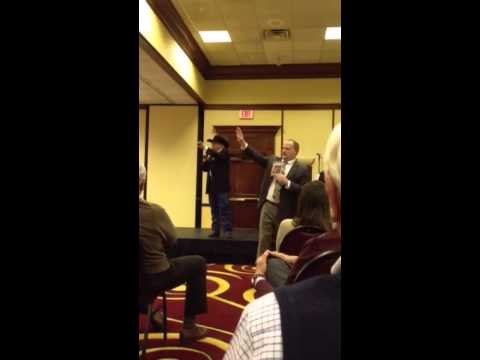
At what (x,y) coordinates should I click in order to perform the action: click on door. Please return your answer as a coordinate pair (x, y). Looking at the image, I should click on (252, 174).